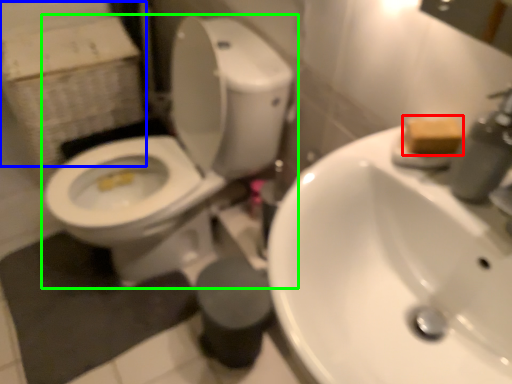
Question: Which object is the closest to the soap (highlighted by a red box)? Choose among these: cardboard box (highlighted by a blue box) or toilet (highlighted by a green box).

Choices:
 (A) cardboard box
 (B) toilet

Answer: (B)